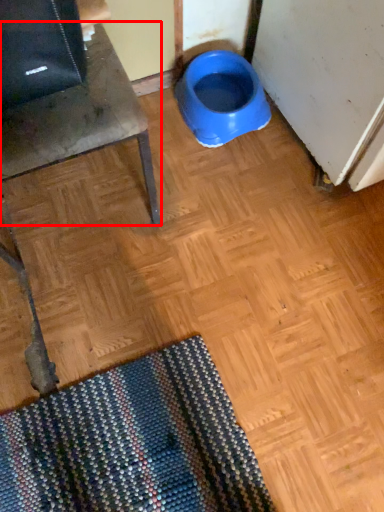
Question: From the image's perspective, what is the correct spatial relationship of furniture (annotated by the red box) in relation to toilet?

Choices:
 (A) above
 (B) below

Answer: (B)